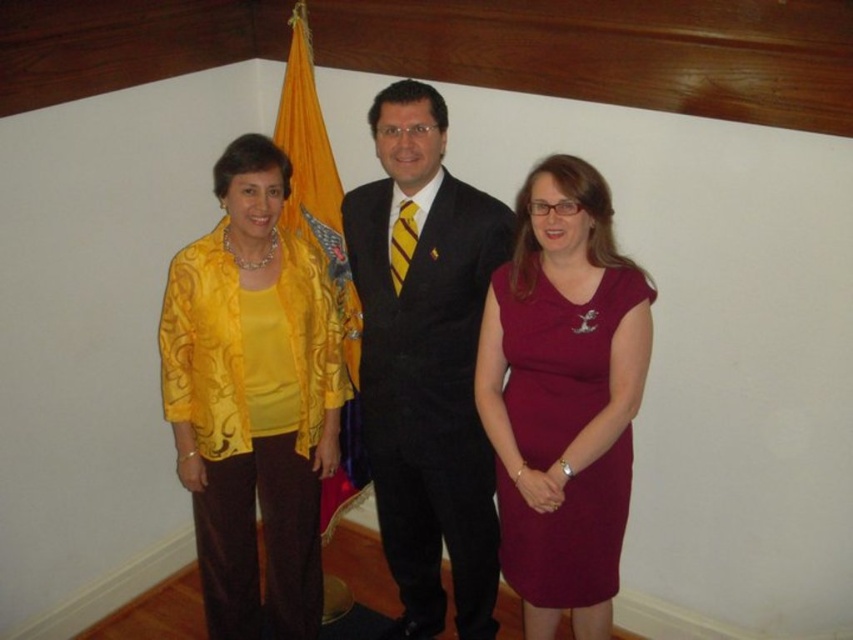
You are standing at point (267, 564) and want to walk to the nearest person. Which person should you walk towards?

The nearest person is the one at point (267, 564), so you are already at that location.

You are a photographer positioned in front of the three people. You want to take a closeup photo of the burgundy satin dress at center without including the other two people. Is the distance sufficient for your camera to focus on the dress?

The burgundy satin dress at center is 2.21 meters away from the viewer, which is a sufficient distance for most cameras to focus on the dress while excluding the other individuals.

You are an event planner arranging seating for a formal dinner. You have two chairs available. One chair is sized for larger individuals and the other for smaller ones. Which chair should the person in the matte black suit at center sit in, and which chair should the person in the burgundy satin dress at center sit in?

The matte black suit at center is bigger than the burgundy satin dress at center, so the person in the matte black suit at center should sit in the chair sized for larger individuals, and the person in the burgundy satin dress at center should sit in the chair sized for smaller ones.